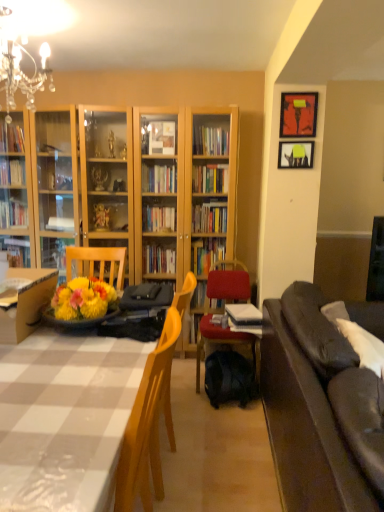
Find the location of a particular element. The height and width of the screenshot is (512, 384). white paper stack at center is located at coordinates (244, 318).

Where is `matte black picture frame at upper right, which is the 1th picture frame from bottom to top`? matte black picture frame at upper right, which is the 1th picture frame from bottom to top is located at coordinates (295, 155).

How much space does matte black picture frame at upper right, which is the 1th picture frame from bottom to top, occupy vertically?

The height of matte black picture frame at upper right, which is the 1th picture frame from bottom to top, is 7.60 inches.

What do you see at coordinates (298, 114) in the screenshot? The width and height of the screenshot is (384, 512). I see `matte black picture frame at upper right, the 2th picture frame ordered from the bottom` at bounding box center [298, 114].

The image size is (384, 512). Describe the element at coordinates (316, 408) in the screenshot. I see `dark brown leather couch at right` at that location.

What do you see at coordinates (216, 311) in the screenshot? The image size is (384, 512). I see `velvet red chair at center` at bounding box center [216, 311].

The width and height of the screenshot is (384, 512). What are the coordinates of `white checkered table at lower left` in the screenshot? It's located at pos(65,418).

From a real-world perspective, which object rests below the other?

In real-world perspective, dark brown leather couch at right is lower.

From the image's perspective, is dark brown leather couch at right located above or below wooden desk at lower left?

From the image's perspective, dark brown leather couch at right appears below wooden desk at lower left.

Is dark brown leather couch at right positioned with its back to wooden desk at lower left?

Absolutely, dark brown leather couch at right is directed away from wooden desk at lower left.

Consider the image. Would you say dark brown leather couch at right is a long distance from wooden desk at lower left?

dark brown leather couch at right is far away from wooden desk at lower left.

Between matte black picture frame at upper right, which is counted as the second picture frame, starting from the top, and wooden desk at lower left, which one appears on the left side from the viewer's perspective?

wooden desk at lower left is more to the left.

From a real-world perspective, is matte black picture frame at upper right, which is counted as the second picture frame, starting from the top, beneath wooden desk at lower left?

No, from a real-world perspective, matte black picture frame at upper right, which is counted as the second picture frame, starting from the top, is not beneath wooden desk at lower left.

Is matte black picture frame at upper right, which is counted as the second picture frame, starting from the top, bigger than wooden desk at lower left?

Actually, matte black picture frame at upper right, which is counted as the second picture frame, starting from the top, might be smaller than wooden desk at lower left.

Is matte black picture frame at upper right, which is counted as the second picture frame, starting from the top, far away from wooden desk at lower left?

Yes, matte black picture frame at upper right, which is counted as the second picture frame, starting from the top, and wooden desk at lower left are located far from each other.

Is wooden desk at lower left positioned behind white checkered table at lower left?

Yes, it is.

Between wooden desk at lower left and white checkered table at lower left, which one has less height?

wooden desk at lower left.

Is wooden desk at lower left turned away from white checkered table at lower left?

wooden desk at lower left is not turned away from white checkered table at lower left.

The height and width of the screenshot is (512, 384). Identify the location of the 1st picture frame to the right of the crystal chandelier at upper left, counting from the anchor's position. (295, 155).

From a real-world perspective, who is located higher, crystal chandelier at upper left or matte black picture frame at upper right, which is the 1th picture frame from bottom to top?

In real-world perspective, crystal chandelier at upper left is above.

Is crystal chandelier at upper left at the left side of matte black picture frame at upper right, which is counted as the second picture frame, starting from the top?

Yes.

Identify the location of table lying below the crystal chandelier at upper left (from the image's perspective). (65, 418).

Visually, is crystal chandelier at upper left positioned to the left or to the right of white checkered table at lower left?

From the image, it's evident that crystal chandelier at upper left is to the left of white checkered table at lower left.

Considering the sizes of objects crystal chandelier at upper left and white checkered table at lower left in the image provided, who is wider, crystal chandelier at upper left or white checkered table at lower left?

crystal chandelier at upper left is wider.

You are a GUI agent. You are given a task and a screenshot of the screen. Output one action in this format:
    pyautogui.click(x=<x>, y=<y>)
    Task: Click on the table in front of the wooden desk at lower left
    
    Given the screenshot: What is the action you would take?
    pyautogui.click(x=65, y=418)

Based on the photo, which object is more forward, white checkered table at lower left or wooden desk at lower left?

white checkered table at lower left is in front.

Which point is more forward, [109,358] or [45,277]?

The point [109,358] is closer.

Between matte black picture frame at upper right, which is counted as the second picture frame, starting from the top, and white paper stack at center, which one has more height?

matte black picture frame at upper right, which is counted as the second picture frame, starting from the top.

From the image's perspective, which is below, matte black picture frame at upper right, which is counted as the second picture frame, starting from the top, or white paper stack at center?

From the image's view, white paper stack at center is below.

In terms of width, does matte black picture frame at upper right, which is counted as the second picture frame, starting from the top, look wider or thinner when compared to white paper stack at center?

matte black picture frame at upper right, which is counted as the second picture frame, starting from the top, is thinner than white paper stack at center.

I want to click on studio couch in front of the wooden desk at lower left, so click(316, 408).

Find the location of a particular element. The image size is (384, 512). picture frame that is the 1st one above the wooden desk at lower left (from a real-world perspective) is located at coordinates (295, 155).

From the image, which object appears to be nearer to white checkered table at lower left, white paper stack at center or matte black picture frame at upper right, the 2th picture frame ordered from the bottom?

The object closer to white checkered table at lower left is white paper stack at center.

Based on their spatial positions, is black matte backpack at lower center or matte black picture frame at upper right, which is the 1th picture frame from bottom to top, further from matte black picture frame at upper right, marked as the 1th picture frame in a top-to-bottom arrangement?

Based on the image, black matte backpack at lower center appears to be further to matte black picture frame at upper right, marked as the 1th picture frame in a top-to-bottom arrangement.

Looking at the image, which one is located closer to matte black picture frame at upper right, which is the 1th picture frame from bottom to top, crystal chandelier at upper left or dark brown leather couch at right?

Among the two, dark brown leather couch at right is located nearer to matte black picture frame at upper right, which is the 1th picture frame from bottom to top.

From the image, which object appears to be farther from white paper stack at center, crystal chandelier at upper left or velvet red chair at center?

Based on the image, crystal chandelier at upper left appears to be further to white paper stack at center.

Considering their positions, is crystal chandelier at upper left positioned closer to matte black picture frame at upper right, the 2th picture frame ordered from the bottom, than matte black picture frame at upper right, which is the 1th picture frame from bottom to top?

The object closer to matte black picture frame at upper right, the 2th picture frame ordered from the bottom, is matte black picture frame at upper right, which is the 1th picture frame from bottom to top.

From the image, which object appears to be nearer to white paper stack at center, black matte backpack at lower center or matte black picture frame at upper right, the 2th picture frame ordered from the bottom?

black matte backpack at lower center is positioned closer to the anchor white paper stack at center.

Looking at the image, which one is located further to white paper stack at center, matte black picture frame at upper right, marked as the 1th picture frame in a top-to-bottom arrangement, or matte black picture frame at upper right, which is the 1th picture frame from bottom to top?

matte black picture frame at upper right, marked as the 1th picture frame in a top-to-bottom arrangement, is further to white paper stack at center.

From the image, which object appears to be farther from black matte backpack at lower center, dark brown leather couch at right or crystal chandelier at upper left?

The object further to black matte backpack at lower center is crystal chandelier at upper left.

Identify the location of book between matte black picture frame at upper right, which is the 1th picture frame from bottom to top, and black matte backpack at lower center in the up-down direction. Image resolution: width=384 pixels, height=512 pixels. (244, 318).

Find the location of a particular element. lamp between dark brown leather couch at right and matte black picture frame at upper right, which is the 1th picture frame from bottom to top, in the front-back direction is located at coordinates (19, 65).

Locate an element on the screen. The height and width of the screenshot is (512, 384). table located between wooden desk at lower left and dark brown leather couch at right in the left-right direction is located at coordinates (65, 418).

Find the location of a particular element. desk between crystal chandelier at upper left and black matte backpack at lower center from top to bottom is located at coordinates (26, 302).